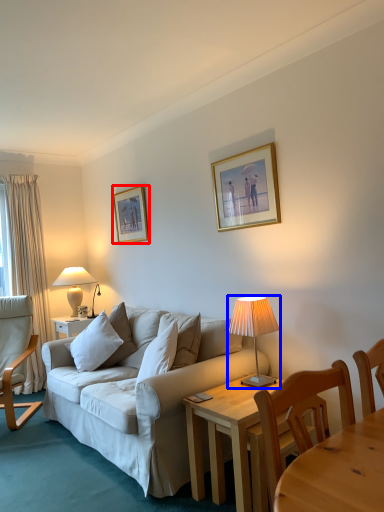
Question: Among these objects, which one is farthest to the camera, picture frame (highlighted by a red box) or lamp (highlighted by a blue box)?

Choices:
 (A) picture frame
 (B) lamp

Answer: (A)